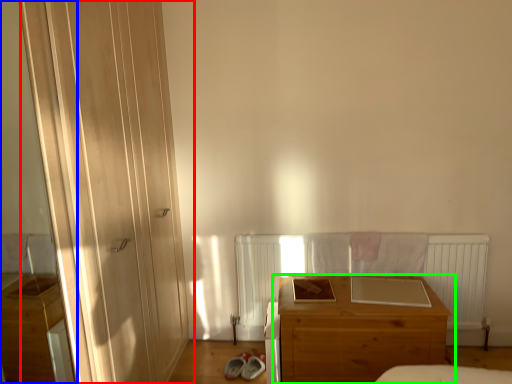
Question: Considering the real-world distances, which object is closest to door (highlighted by a red box)? screen door (highlighted by a blue box) or chest of drawers (highlighted by a green box).

Choices:
 (A) screen door
 (B) chest of drawers

Answer: (B)